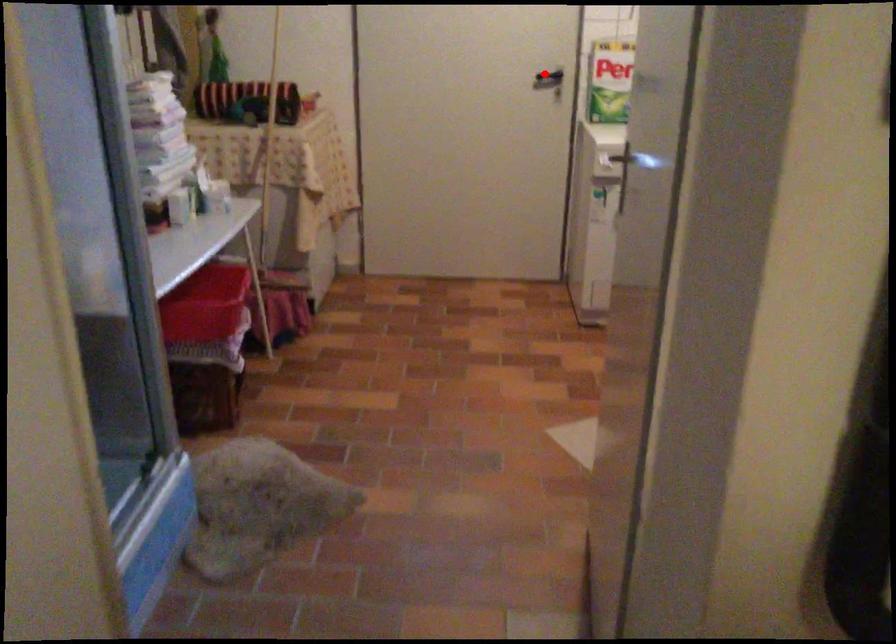
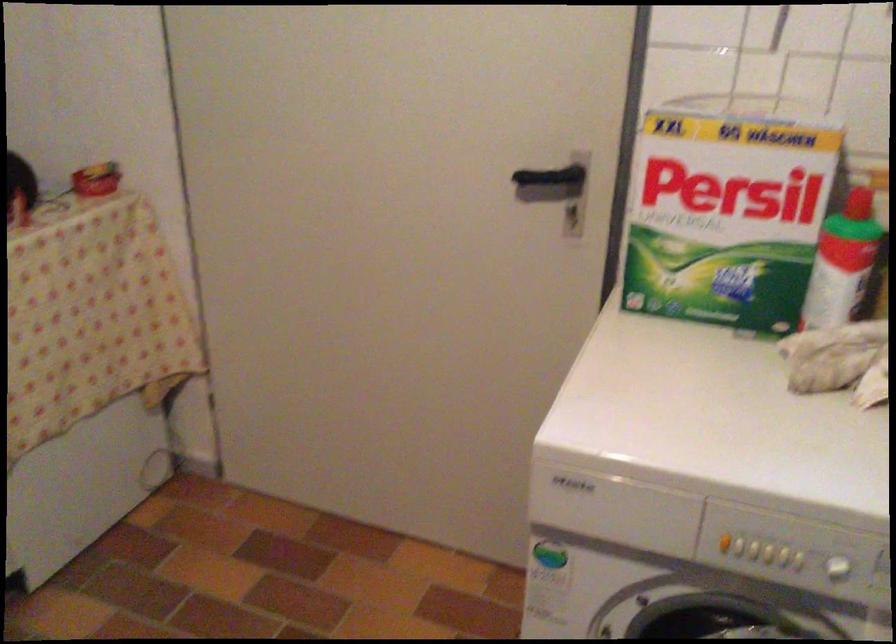
Question: I am providing you with two images of the same scene from different viewpoints. A red point is shown in image1. For the corresponding object point in image2, is it positioned nearer or farther from the camera?

Choices:
 (A) Nearer
 (B) Farther

Answer: (A)